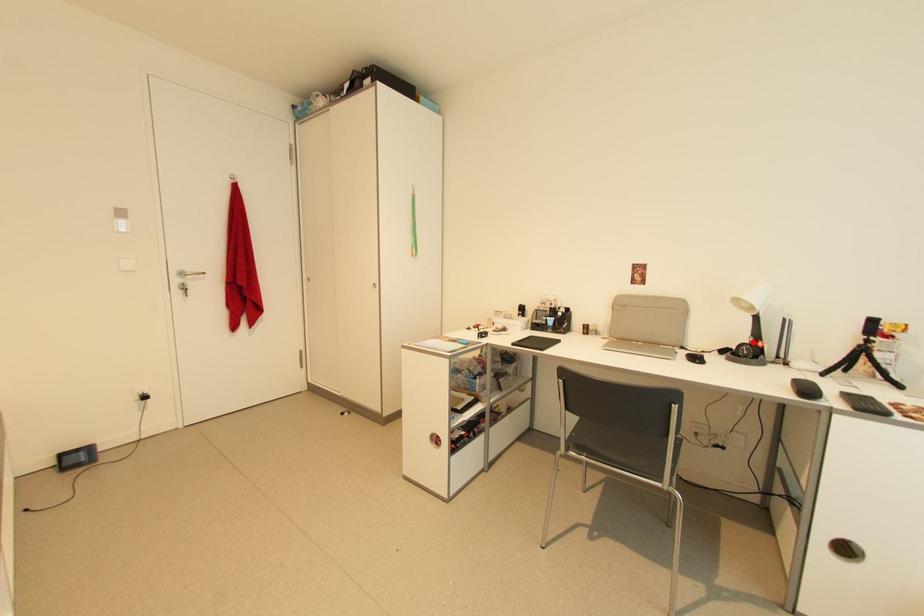
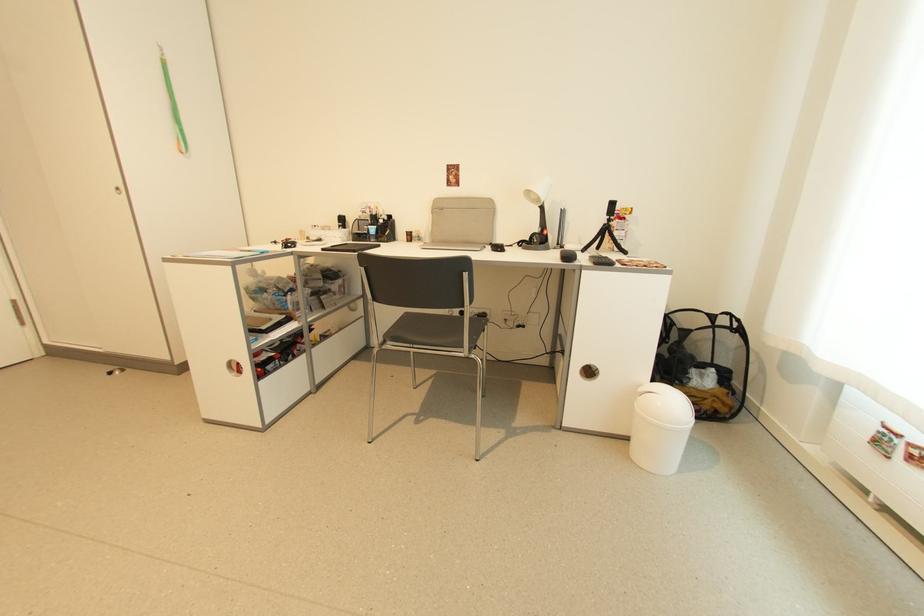
Question: I am providing you with two images of the same scene from different viewpoints. A red point is shown in image1. For the corresponding object point in image2, is it positioned nearer or farther from the camera?

Choices:
 (A) Nearer
 (B) Farther

Answer: (A)